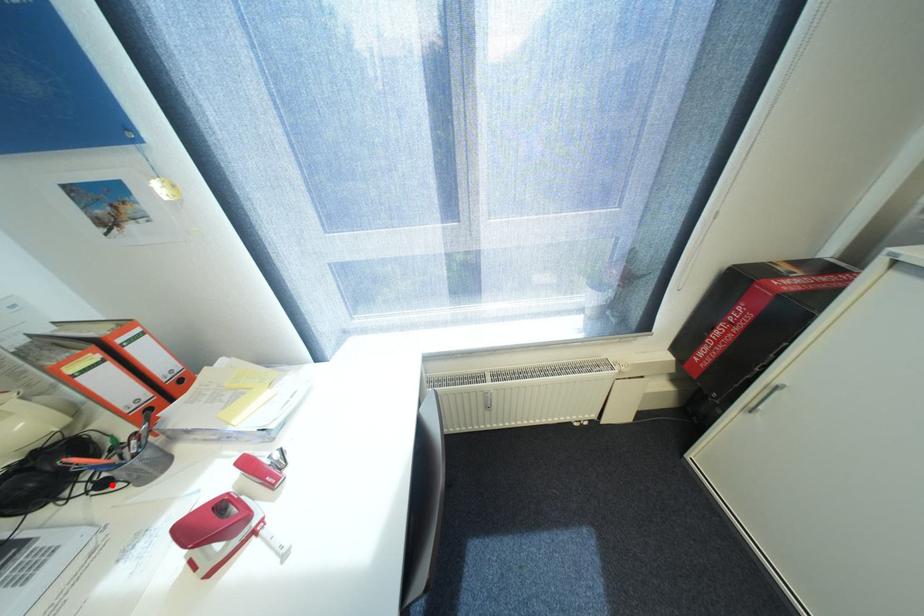
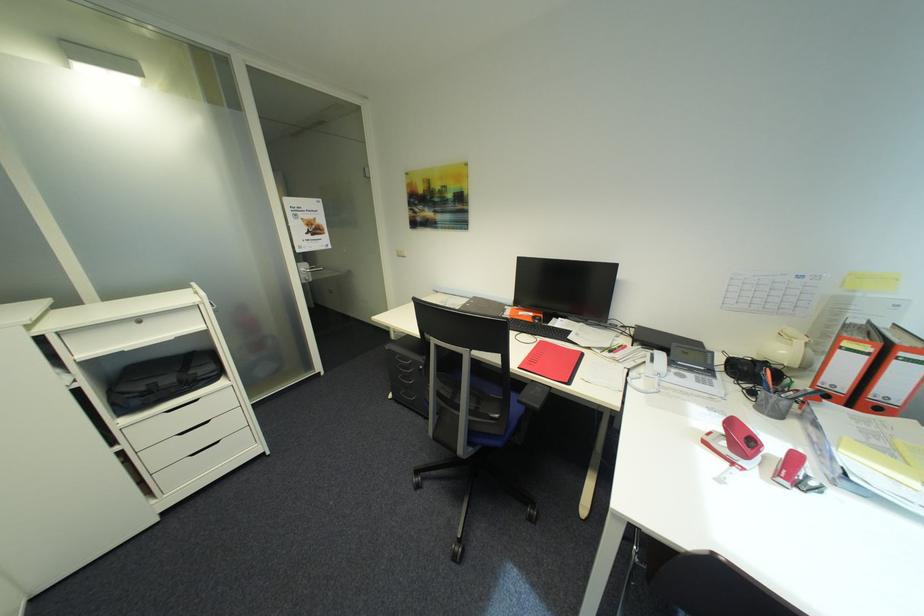
Find the pixel in the second image that matches the highlighted location in the first image.

(760, 392)